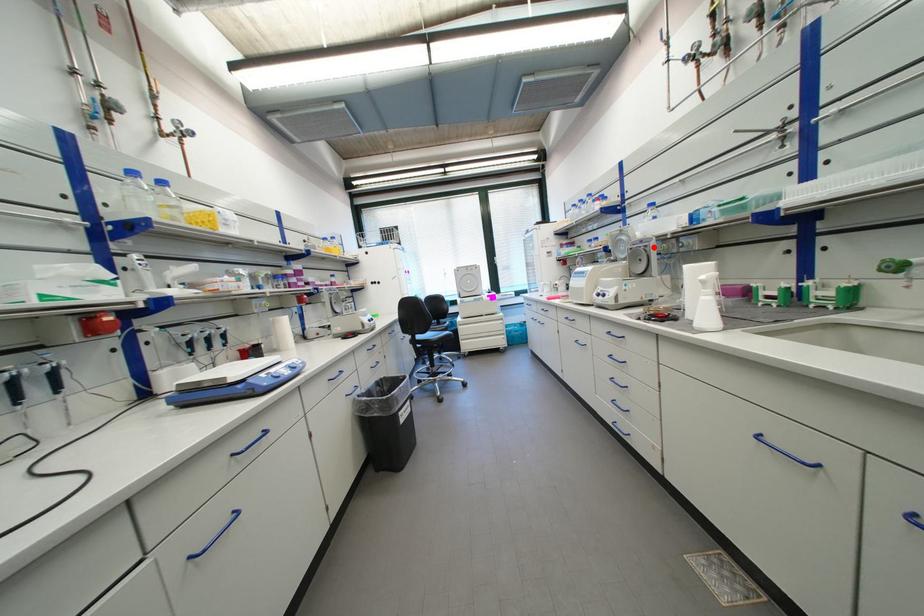
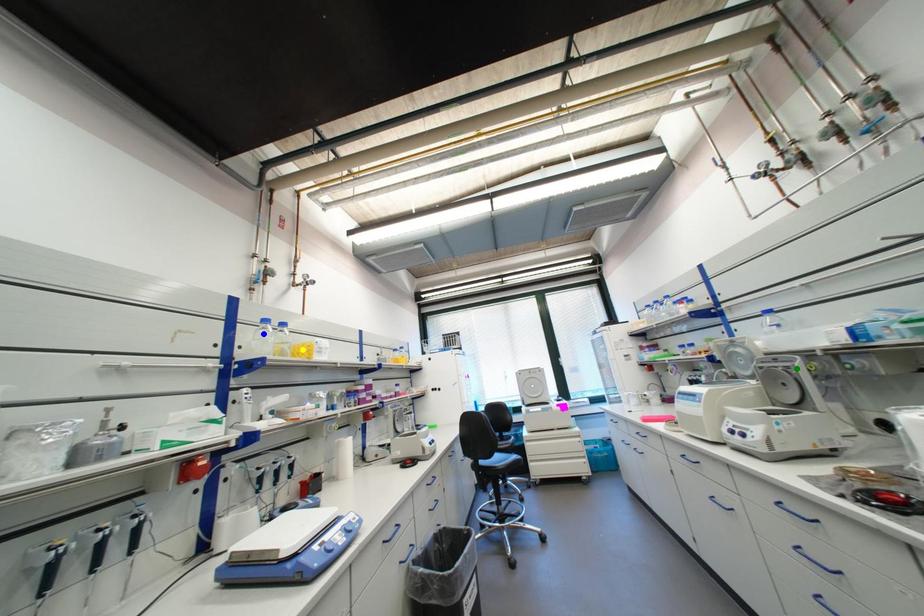
Question: I am providing you with two images of the same scene from different viewpoints. A red point is marked on the first image. You are given multiple points on the second image. Which point in image 2 is actually the same real-world point as the red point in image 1?

Choices:
 (A) yellow point
 (B) green point
 (C) blue point

Answer: (B)